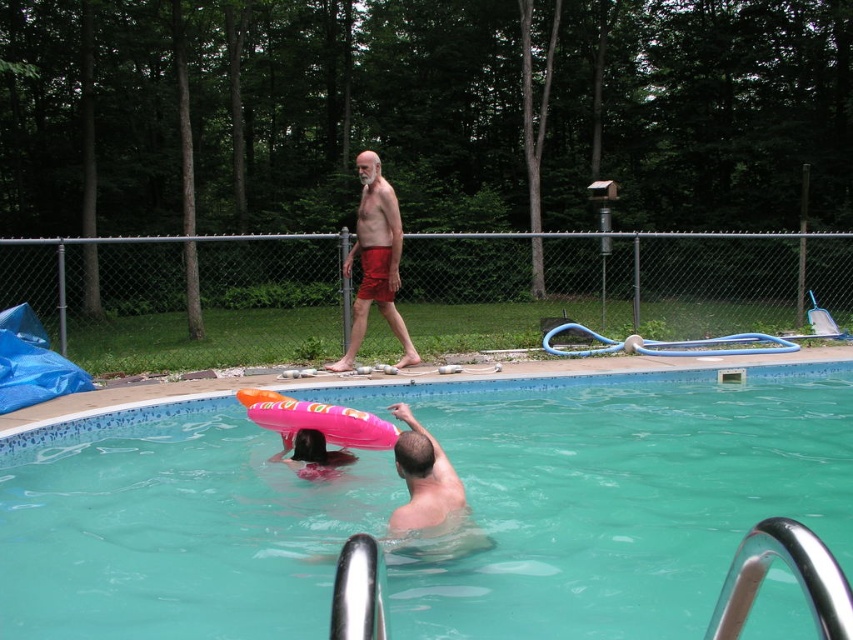
Question: Is teal smooth water at center to the right of pink foam float at lower center from the viewer's perspective?

Choices:
 (A) yes
 (B) no

Answer: (A)

Question: Estimate the real-world distances between objects in this image. Which object is closer to the teal smooth water at center?

Choices:
 (A) matte red shorts at center
 (B) pink foam float at lower center

Answer: (B)

Question: Does teal smooth water at center come in front of matte red shorts at center?

Choices:
 (A) yes
 (B) no

Answer: (A)

Question: Which object appears closest to the camera in this image?

Choices:
 (A) matte red shorts at center
 (B) pink foam float at lower center
 (C) teal smooth water at center

Answer: (B)

Question: Does teal smooth water at center have a greater width compared to matte red shorts at center?

Choices:
 (A) no
 (B) yes

Answer: (B)

Question: Based on their relative distances, which object is nearer to the teal smooth water at center?

Choices:
 (A) matte red shorts at center
 (B) pink foam float at lower center

Answer: (B)